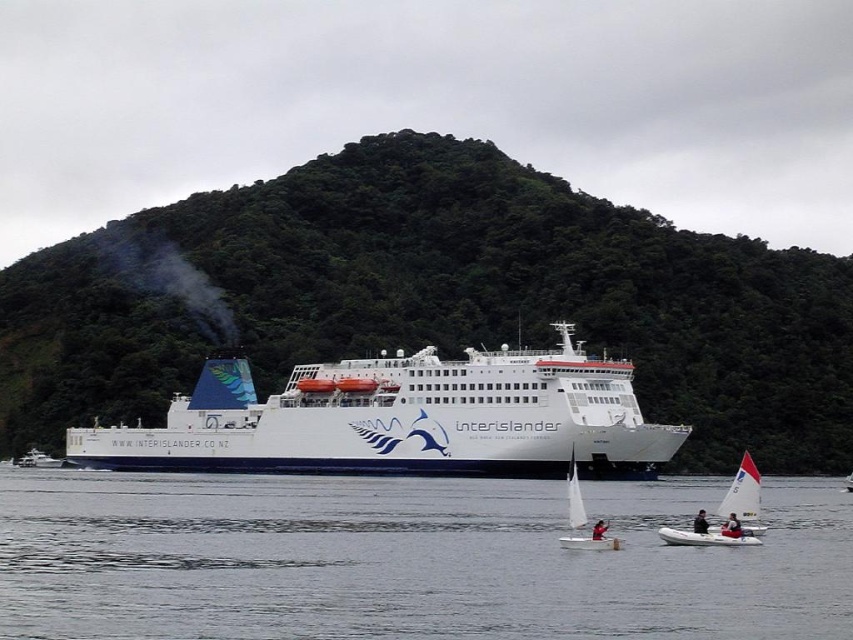
Which is behind, point (587, 536) or point (22, 458)?

The point (22, 458) is more distant.

Is point (606, 545) positioned before point (33, 456)?

Yes.

Does point (569, 516) come behind point (54, 458)?

No, (569, 516) is closer to viewer.

At what (x,y) coordinates should I click in order to perform the action: click on white sailboat at lower center. Please return your answer as a coordinate pair (x, y). Looking at the image, I should click on (590, 538).

Is white sailboat at lower right taller than white sailboat at lower center?

Yes.

Where is `white sailboat at lower right`? The height and width of the screenshot is (640, 853). white sailboat at lower right is located at coordinates (726, 515).

What do you see at coordinates (405, 560) in the screenshot?
I see `clear water at center` at bounding box center [405, 560].

Is the position of clear water at center more distant than that of white glossy yacht at lower left?

No, clear water at center is closer to the viewer.

Which is behind, point (592, 630) or point (42, 451)?

The point (42, 451) is behind.

At what (x,y) coordinates should I click in order to perform the action: click on clear water at center. Please return your answer as a coordinate pair (x, y). This screenshot has width=853, height=640. Looking at the image, I should click on (405, 560).